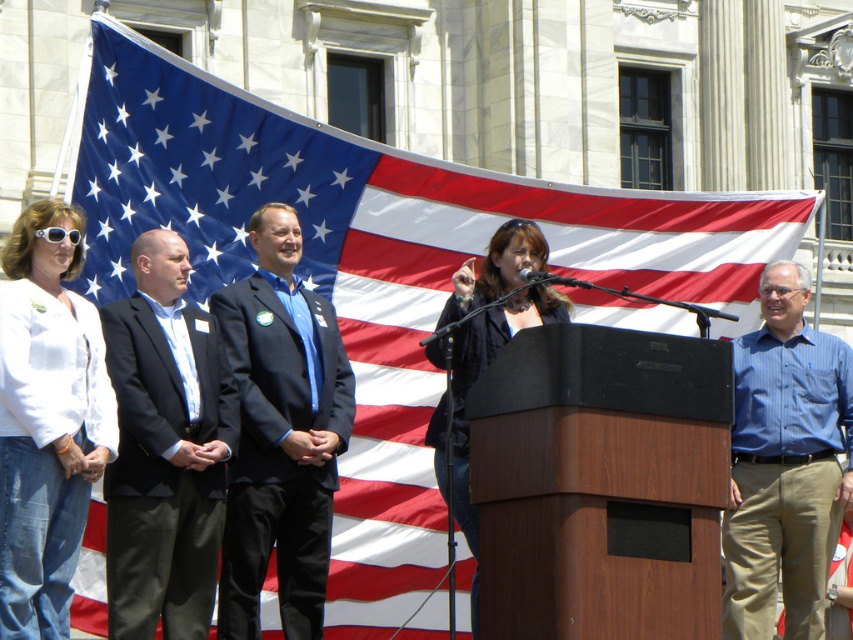
Question: Which point is farther to the camera?

Choices:
 (A) (x=79, y=499)
 (B) (x=201, y=497)

Answer: (B)

Question: Does white cotton shirt at upper left have a lesser width compared to denim jacket at center?

Choices:
 (A) yes
 (B) no

Answer: (A)

Question: Estimate the real-world distances between objects in this image. Which object is farther from the blue striped shirt at right?

Choices:
 (A) denim jacket at center
 (B) white plastic goggles at upper left
 (C) white cotton shirt at upper left

Answer: (B)

Question: Does blue striped shirt at right have a larger size compared to denim jacket at center?

Choices:
 (A) no
 (B) yes

Answer: (A)

Question: Based on their relative distances, which object is nearer to the dark blue suit at center?

Choices:
 (A) white cotton shirt at upper left
 (B) black suit at center
 (C) denim jacket at center

Answer: (B)

Question: Does black suit at center appear on the right side of dark blue suit at center?

Choices:
 (A) yes
 (B) no

Answer: (B)